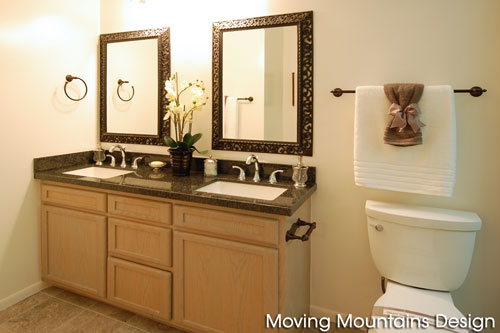
At what (x,y) coordinates should I click in order to perform the action: click on brown floor. Please return your answer as a coordinate pair (x, y). The image size is (500, 333). Looking at the image, I should click on (55, 311).